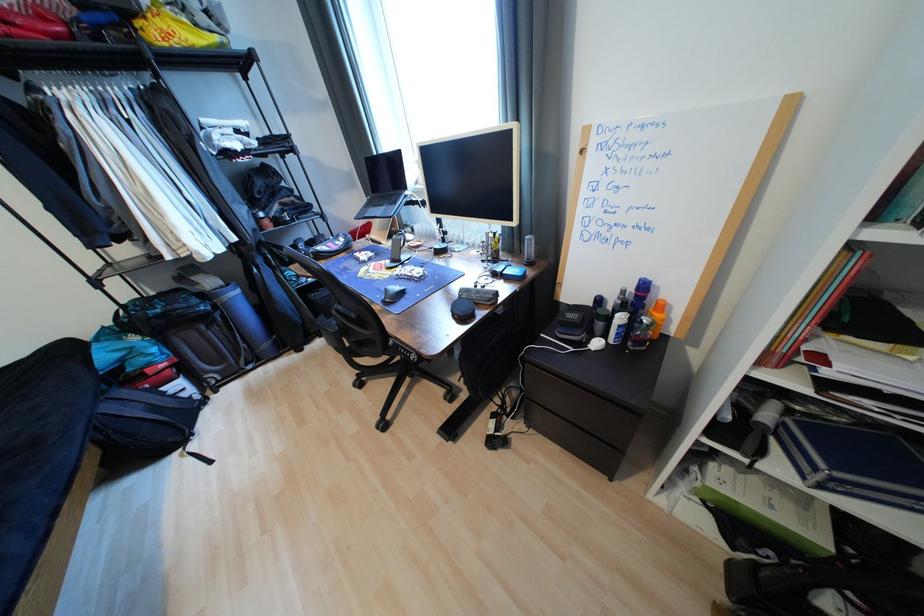
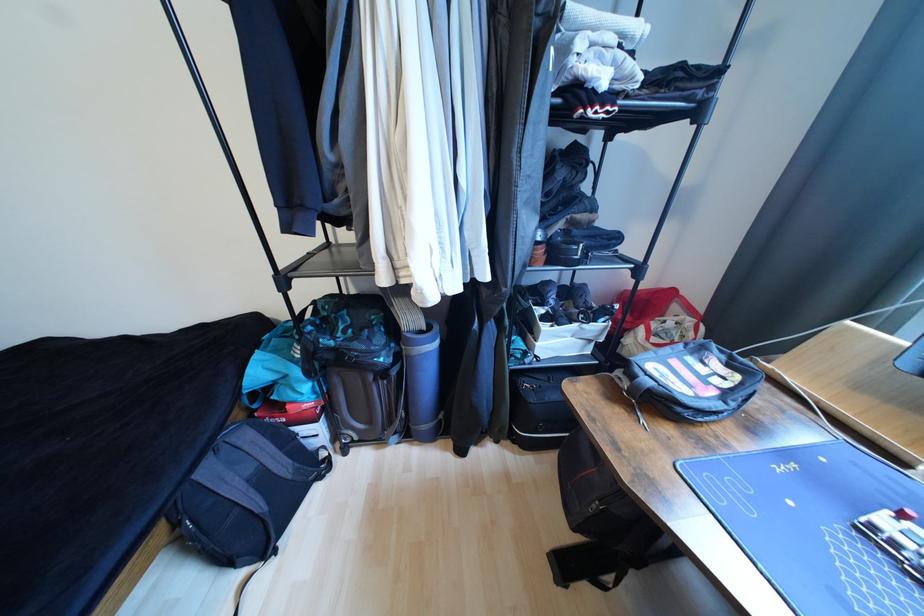
Where in the second image is the point corresponding to (x=116, y=408) from the first image?

(215, 472)